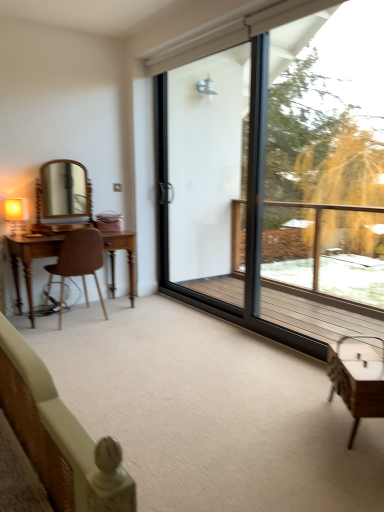
Locate an element on the screen. free point to the right of wooden desk at left, the 2th table from the front is located at coordinates (153, 313).